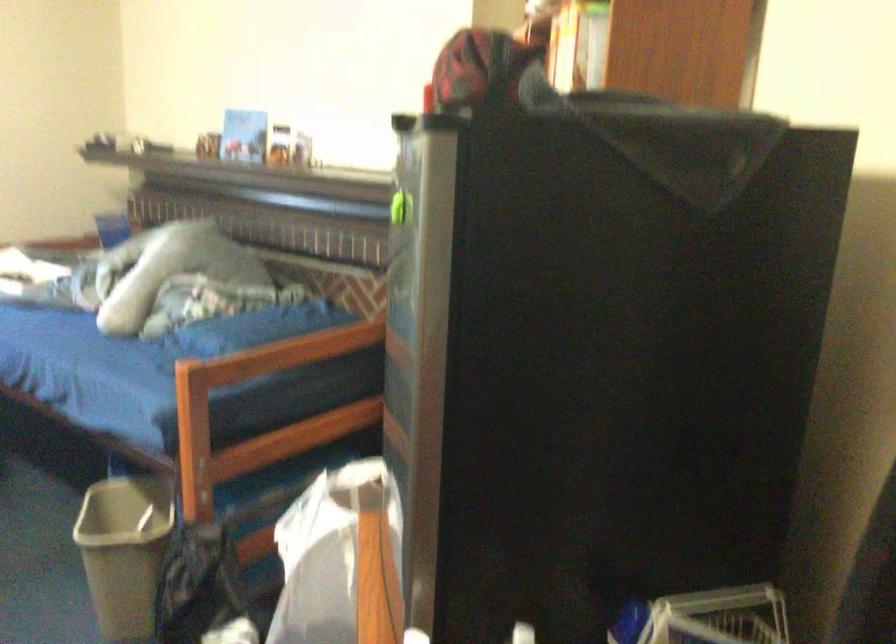
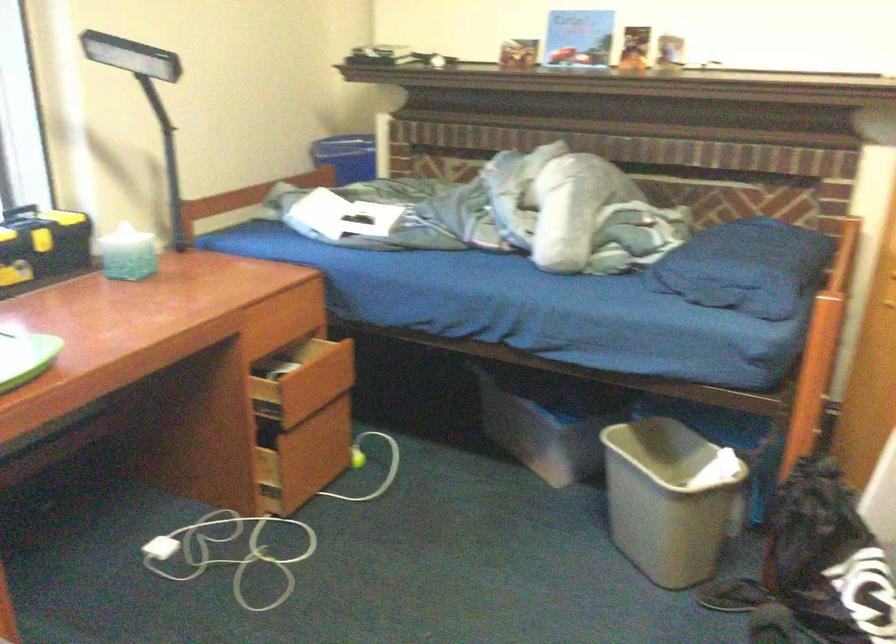
Question: What movement of the cameraman would produce the second image?

Choices:
 (A) Left
 (B) Right
 (C) Forward
 (D) Backward

Answer: (A)